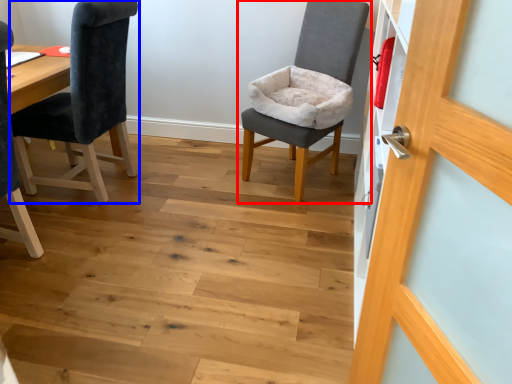
Question: Which of the following is the farthest to the observer, chair (highlighted by a red box) or chair (highlighted by a blue box)?

Choices:
 (A) chair
 (B) chair

Answer: (A)